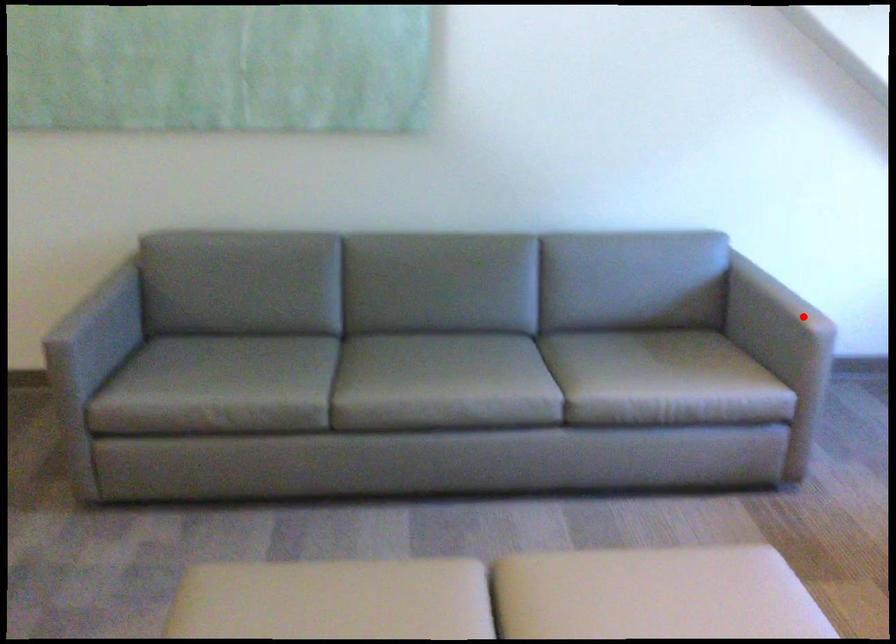
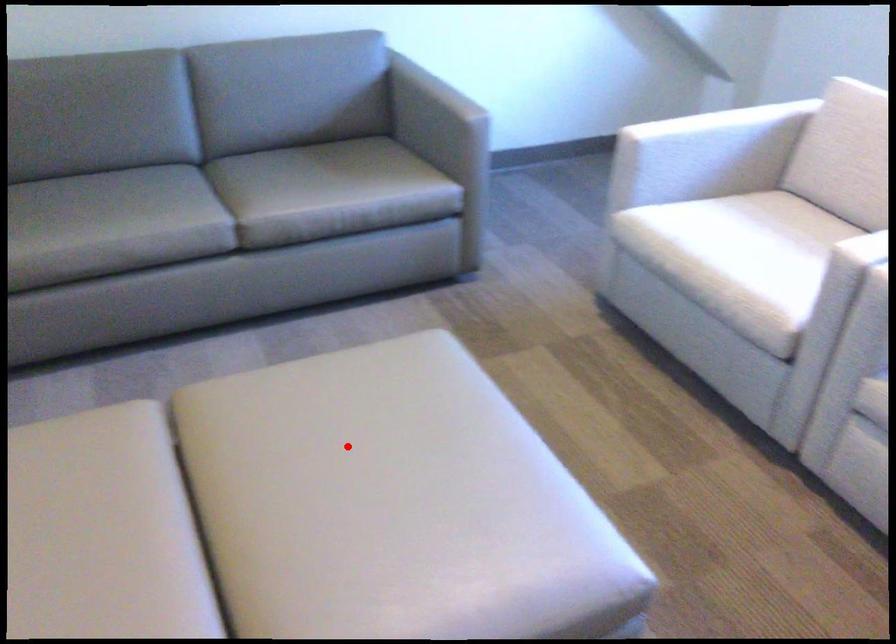
I am providing you with two images of the same scene from different viewpoints. A red point is marked on the first image and another point is marked on the second image. Does the point marked in image1 correspond to the same location as the one in image2?

No